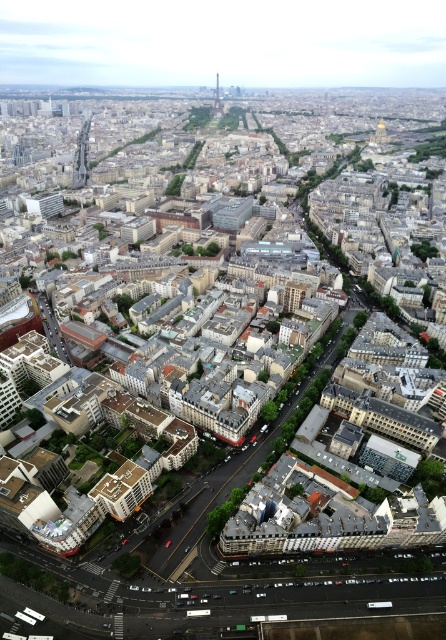
You are a drone operator who needs to fly a drone from the smooth glass skyscraper at upper left to the shiny metallic tower at center. According to the image, which direction should you fly the drone to reach the destination?

The smooth glass skyscraper at upper left is positioned on the left side of the shiny metallic tower at center, so you should fly the drone to the right to reach the destination.

Looking at the urban scene from above, you notice the smooth glass skyscraper at upper left and the shiny metallic tower at center. Which of these two structures has a greater width?

The smooth glass skyscraper at upper left has a greater width than the shiny metallic tower at center according to the description.